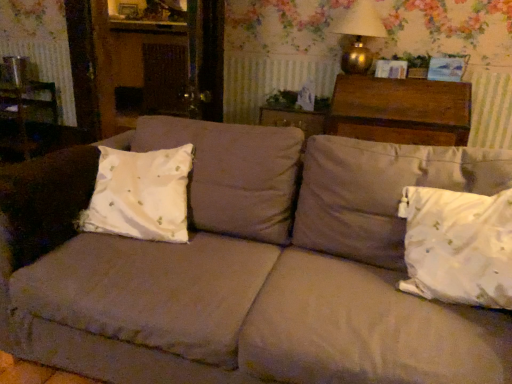
Find the location of a particular element. Image resolution: width=512 pixels, height=384 pixels. white cotton pillow at left, the second pillow positioned from the right is located at coordinates (140, 194).

Measure the distance between point [408,234] and camera.

Point [408,234] is 1.40 meters from camera.

This screenshot has height=384, width=512. What do you see at coordinates (458, 246) in the screenshot? I see `white satin pillow at lower right, the 2th pillow from the left` at bounding box center [458, 246].

This screenshot has height=384, width=512. What do you see at coordinates (128, 10) in the screenshot? I see `wooden picture frame at upper center` at bounding box center [128, 10].

What is the approximate height of wooden picture frame at upper center?

The height of wooden picture frame at upper center is 22.13 centimeters.

In order to face dark brown wood chest at upper right, should I rotate leftwards or rightwards?

Turn right approximately 18.085 degrees to face it.

Describe the element at coordinates (400, 110) in the screenshot. I see `dark brown wood chest at upper right` at that location.

Where is `white cotton pillow at left, the second pillow positioned from the right`? The image size is (512, 384). white cotton pillow at left, the second pillow positioned from the right is located at coordinates (140, 194).

In the scene shown: From a real-world perspective, who is located lower, gold metallic table lamp at upper right or white cotton pillow at left, which is the 1th pillow from left to right?

white cotton pillow at left, which is the 1th pillow from left to right.

Considering the relative sizes of gold metallic table lamp at upper right and white cotton pillow at left, the second pillow positioned from the right, in the image provided, is gold metallic table lamp at upper right bigger than white cotton pillow at left, the second pillow positioned from the right,?

Actually, gold metallic table lamp at upper right might be smaller than white cotton pillow at left, the second pillow positioned from the right.

Considering the positions of objects gold metallic table lamp at upper right and white cotton pillow at left, the second pillow positioned from the right, in the image provided, who is in front, gold metallic table lamp at upper right or white cotton pillow at left, the second pillow positioned from the right,?

white cotton pillow at left, the second pillow positioned from the right, is closer to the camera.

Measure the distance between gold metallic table lamp at upper right and white cotton pillow at left, which is the 1th pillow from left to right.

gold metallic table lamp at upper right is 5.29 feet away from white cotton pillow at left, which is the 1th pillow from left to right.

Based on their positions, is white cotton pillow at left, the second pillow positioned from the right, located to the left or right of dark brown wood chest at upper right?

Based on their positions, white cotton pillow at left, the second pillow positioned from the right, is located to the left of dark brown wood chest at upper right.

From a real-world perspective, is white cotton pillow at left, which is the 1th pillow from left to right, under dark brown wood chest at upper right?

Yes.

Is white cotton pillow at left, which is the 1th pillow from left to right, smaller than dark brown wood chest at upper right?

Indeed, white cotton pillow at left, which is the 1th pillow from left to right, has a smaller size compared to dark brown wood chest at upper right.

Looking at the image, does white cotton pillow at left, the second pillow positioned from the right, seem bigger or smaller compared to beige fabric couch at center?

In the image, white cotton pillow at left, the second pillow positioned from the right, appears to be smaller than beige fabric couch at center.

Consider the image. Which object is thinner, white cotton pillow at left, the second pillow positioned from the right, or beige fabric couch at center?

white cotton pillow at left, the second pillow positioned from the right, is thinner.

From their relative heights in the image, would you say white cotton pillow at left, which is the 1th pillow from left to right, is taller or shorter than beige fabric couch at center?

Clearly, white cotton pillow at left, which is the 1th pillow from left to right, is shorter compared to beige fabric couch at center.

From the image's perspective, is white cotton pillow at left, which is the 1th pillow from left to right, on top of beige fabric couch at center?

Yes, from the image's perspective, white cotton pillow at left, which is the 1th pillow from left to right, is over beige fabric couch at center.

Does white satin pillow at lower right, the 2th pillow from the left, have a lesser width compared to dark brown wood chest at upper right?

Correct, the width of white satin pillow at lower right, the 2th pillow from the left, is less than that of dark brown wood chest at upper right.

Does point (421, 275) lie behind point (409, 122)?

That is False.

Is white satin pillow at lower right, marked as the 1th pillow in a right-to-left arrangement, oriented towards dark brown wood chest at upper right?

No.

Is white satin pillow at lower right, marked as the 1th pillow in a right-to-left arrangement, spatially inside dark brown wood chest at upper right, or outside of it?

white satin pillow at lower right, marked as the 1th pillow in a right-to-left arrangement, is located beyond the bounds of dark brown wood chest at upper right.

From their relative heights in the image, would you say beige fabric couch at center is taller or shorter than gold metallic table lamp at upper right?

Clearly, beige fabric couch at center is taller compared to gold metallic table lamp at upper right.

The image size is (512, 384). I want to click on table lamp that is above the beige fabric couch at center (from the image's perspective), so click(359, 35).

Can you see beige fabric couch at center touching gold metallic table lamp at upper right?

No, beige fabric couch at center is not in contact with gold metallic table lamp at upper right.

Which object is positioned more to the left, beige fabric couch at center or gold metallic table lamp at upper right?

beige fabric couch at center is more to the left.

Is wooden picture frame at upper center to the left of white cotton pillow at left, the second pillow positioned from the right, from the viewer's perspective?

Indeed, wooden picture frame at upper center is positioned on the left side of white cotton pillow at left, the second pillow positioned from the right.

Considering the relative sizes of wooden picture frame at upper center and white cotton pillow at left, the second pillow positioned from the right, in the image provided, is wooden picture frame at upper center smaller than white cotton pillow at left, the second pillow positioned from the right,?

Yes.

From the image's perspective, who appears lower, wooden picture frame at upper center or white cotton pillow at left, which is the 1th pillow from left to right?

white cotton pillow at left, which is the 1th pillow from left to right, appears lower in the image.

Is wooden picture frame at upper center not close to white cotton pillow at left, the second pillow positioned from the right?

wooden picture frame at upper center is positioned a significant distance from white cotton pillow at left, the second pillow positioned from the right.

From the image's perspective, is dark brown wood chest at upper right above white cotton pillow at left, the second pillow positioned from the right?

Indeed, from the image's perspective, dark brown wood chest at upper right is shown above white cotton pillow at left, the second pillow positioned from the right.

The width and height of the screenshot is (512, 384). What are the coordinates of `pillow that is the 2nd one when counting leftward from the dark brown wood chest at upper right` in the screenshot? It's located at (140, 194).

Can you tell me how much dark brown wood chest at upper right and white cotton pillow at left, which is the 1th pillow from left to right, differ in facing direction?

The angular difference between dark brown wood chest at upper right and white cotton pillow at left, which is the 1th pillow from left to right, is 0.936 degrees.

You are a GUI agent. You are given a task and a screenshot of the screen. Output one action in this format:
    pyautogui.click(x=<x>, y=<y>)
    Task: Click on the table lamp behind the white cotton pillow at left, which is the 1th pillow from left to right
    The image size is (512, 384).
    Given the screenshot: What is the action you would take?
    pyautogui.click(x=359, y=35)

From the dark brown wood chest at upper right, count 1st pillows forward and point to it. Please provide its 2D coordinates.

[(140, 194)]

Estimate the real-world distances between objects in this image. Which object is further from beige fabric couch at center, white satin pillow at lower right, the 2th pillow from the left, or white cotton pillow at left, the second pillow positioned from the right?

white satin pillow at lower right, the 2th pillow from the left.

Looking at the image, which one is located closer to white cotton pillow at left, which is the 1th pillow from left to right, white satin pillow at lower right, marked as the 1th pillow in a right-to-left arrangement, or wooden picture frame at upper center?

white satin pillow at lower right, marked as the 1th pillow in a right-to-left arrangement.

Looking at the image, which one is located further to white satin pillow at lower right, the 2th pillow from the left, wooden picture frame at upper center or beige fabric couch at center?

Among the two, wooden picture frame at upper center is located further to white satin pillow at lower right, the 2th pillow from the left.

From the image, which object appears to be farther from wooden picture frame at upper center, gold metallic table lamp at upper right or beige fabric couch at center?

Among the two, beige fabric couch at center is located further to wooden picture frame at upper center.

Looking at the image, which one is located closer to wooden picture frame at upper center, gold metallic table lamp at upper right or dark brown wood chest at upper right?

gold metallic table lamp at upper right.

Based on their spatial positions, is dark brown wood chest at upper right or white satin pillow at lower right, the 2th pillow from the left, closer to wooden picture frame at upper center?

dark brown wood chest at upper right lies closer to wooden picture frame at upper center than the other object.

Considering their positions, is dark brown wood chest at upper right positioned further to white satin pillow at lower right, marked as the 1th pillow in a right-to-left arrangement, than white cotton pillow at left, the second pillow positioned from the right?

dark brown wood chest at upper right is further to white satin pillow at lower right, marked as the 1th pillow in a right-to-left arrangement.

Looking at the image, which one is located further to white satin pillow at lower right, the 2th pillow from the left, gold metallic table lamp at upper right or beige fabric couch at center?

gold metallic table lamp at upper right lies further to white satin pillow at lower right, the 2th pillow from the left, than the other object.

Find the location of a particular element. The width and height of the screenshot is (512, 384). hardwood positioned between white cotton pillow at left, the second pillow positioned from the right, and wooden picture frame at upper center from near to far is located at coordinates (400, 110).

I want to click on pillow between white satin pillow at lower right, the 2th pillow from the left, and gold metallic table lamp at upper right, along the z-axis, so coord(140,194).

Locate an element on the screen. This screenshot has height=384, width=512. hardwood between beige fabric couch at center and gold metallic table lamp at upper right from front to back is located at coordinates (400, 110).

This screenshot has height=384, width=512. I want to click on table lamp located between dark brown wood chest at upper right and wooden picture frame at upper center in the depth direction, so click(359, 35).